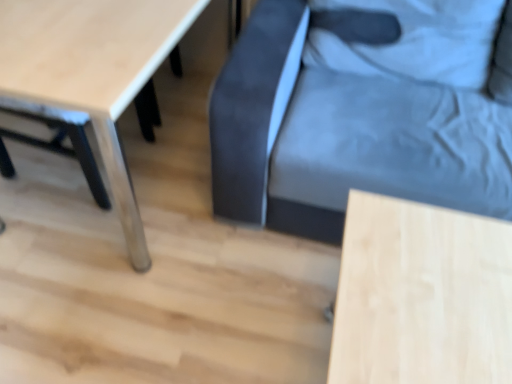
Question: Can you see light wood table at lower right, the 1th table viewed from the right, touching dark blue fabric swivel chair at center?

Choices:
 (A) yes
 (B) no

Answer: (B)

Question: Can you confirm if light wood table at lower right, the 1th table viewed from the right, is bigger than dark blue fabric swivel chair at center?

Choices:
 (A) no
 (B) yes

Answer: (A)

Question: Is light wood table at lower right, acting as the second table starting from the left, taller than dark blue fabric swivel chair at center?

Choices:
 (A) yes
 (B) no

Answer: (B)

Question: From a real-world perspective, is light wood table at lower right, the 1th table viewed from the right, physically below dark blue fabric swivel chair at center?

Choices:
 (A) no
 (B) yes

Answer: (B)

Question: Is the position of light wood table at lower right, acting as the second table starting from the left, more distant than that of dark blue fabric swivel chair at center?

Choices:
 (A) yes
 (B) no

Answer: (B)

Question: Is light wood table at lower right, the 1th table viewed from the right, situated inside light wood table at lower left, placed as the 1th table when sorted from left to right, or outside?

Choices:
 (A) outside
 (B) inside

Answer: (A)

Question: Considering their positions, is light wood table at lower right, acting as the second table starting from the left, located in front of or behind light wood table at lower left, placed as the 1th table when sorted from left to right?

Choices:
 (A) behind
 (B) front

Answer: (B)

Question: In the image, is light wood table at lower right, acting as the second table starting from the left, on the left side or the right side of light wood table at lower left, arranged as the second table when viewed from the right?

Choices:
 (A) right
 (B) left

Answer: (A)

Question: In terms of size, does light wood table at lower right, acting as the second table starting from the left, appear bigger or smaller than light wood table at lower left, placed as the 1th table when sorted from left to right?

Choices:
 (A) big
 (B) small

Answer: (B)

Question: Is point (140, 231) closer or farther from the camera than point (507, 82)?

Choices:
 (A) farther
 (B) closer

Answer: (A)

Question: From the image's perspective, is light wood table at lower left, placed as the 1th table when sorted from left to right, positioned above or below dark blue fabric swivel chair at center?

Choices:
 (A) above
 (B) below

Answer: (A)

Question: Relative to dark blue fabric swivel chair at center, is light wood table at lower left, placed as the 1th table when sorted from left to right, in front or behind?

Choices:
 (A) behind
 (B) front

Answer: (B)

Question: Looking at the image, does light wood table at lower left, arranged as the second table when viewed from the right, seem bigger or smaller compared to dark blue fabric swivel chair at center?

Choices:
 (A) big
 (B) small

Answer: (B)

Question: From the image's perspective, relative to light wood table at lower right, acting as the second table starting from the left, is dark blue fabric swivel chair at center above or below?

Choices:
 (A) above
 (B) below

Answer: (A)

Question: Does point (260, 26) appear closer or farther from the camera than point (455, 271)?

Choices:
 (A) closer
 (B) farther

Answer: (B)